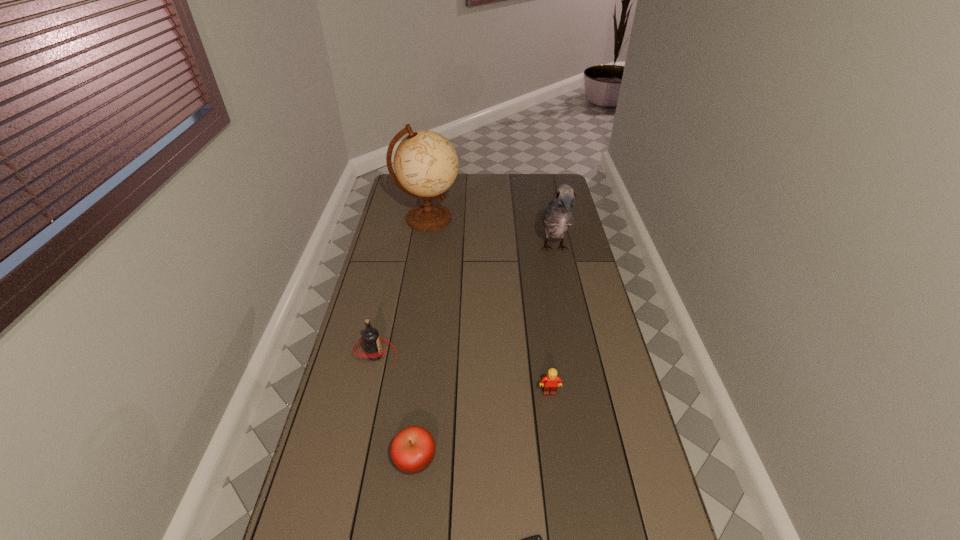
Where is `the tallest object`? This screenshot has height=540, width=960. the tallest object is located at coordinates (426, 164).

This screenshot has height=540, width=960. What are the coordinates of `the fifth shortest object` in the screenshot? It's located at (558, 216).

Locate an element on the screen. This screenshot has height=540, width=960. parrot is located at coordinates (558, 216).

The width and height of the screenshot is (960, 540). In order to click on root beer in this screenshot , I will do `click(370, 337)`.

Identify the location of the fourth shortest object. The width and height of the screenshot is (960, 540). (370, 337).

Locate an element on the screen. The height and width of the screenshot is (540, 960). apple is located at coordinates (412, 450).

Where is `the third nearest object`? The height and width of the screenshot is (540, 960). the third nearest object is located at coordinates (550, 383).

In order to click on the second object from right to left in this screenshot , I will do `click(550, 383)`.

The image size is (960, 540). Find the location of `vacant space located 0.190m on the surface of the globe`. vacant space located 0.190m on the surface of the globe is located at coordinates (500, 219).

At what (x,y) coordinates should I click in order to perform the action: click on free point located on the front-facing side of the parrot. Please return your answer as a coordinate pair (x, y). Looking at the image, I should click on (561, 279).